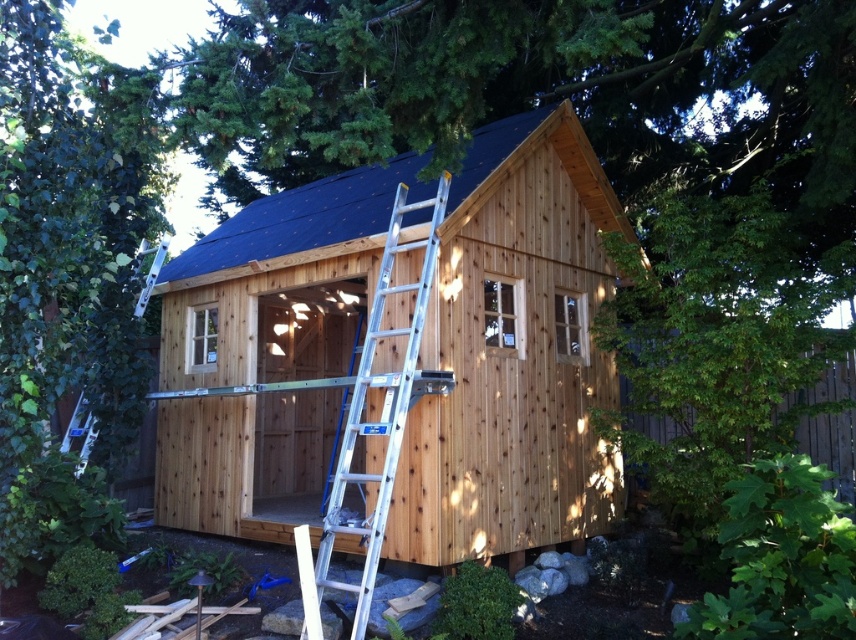
From the picture: Measure the distance between dark blue shingles at upper center and camera.

dark blue shingles at upper center and camera are 5.81 meters apart from each other.

Does point (613, 218) lie in front of point (76, 424)?

No, it is behind (76, 424).

The image size is (856, 640). What are the coordinates of `dark blue shingles at upper center` in the screenshot? It's located at (299, 225).

Which of these two, silver metallic ladder at center or white metallic ladder at upper left, stands taller?

silver metallic ladder at center is taller.

Does silver metallic ladder at center appear on the left side of white metallic ladder at upper left?

In fact, silver metallic ladder at center is to the right of white metallic ladder at upper left.

Does point (390, 440) lie in front of point (135, 262)?

Yes.

Where is `silver metallic ladder at center`? silver metallic ladder at center is located at coordinates (373, 422).

How distant is natural wood cabin at center from dark blue shingles at upper center?

1.22 meters

Does point (214, 444) lie behind point (247, 228)?

No, it is in front of (247, 228).

Is point (345, 205) farther from camera compared to point (556, 118)?

Yes, it is.

Where is `natural wood cabin at center`? The height and width of the screenshot is (640, 856). natural wood cabin at center is located at coordinates (513, 353).